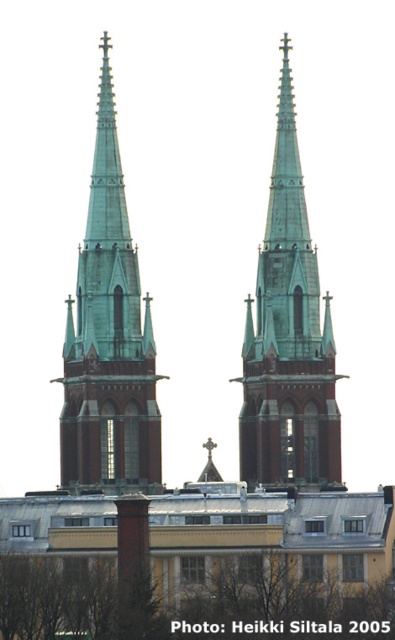
Question: Which point is closer to the camera taking this photo?

Choices:
 (A) (235, 616)
 (B) (257, 308)

Answer: (A)

Question: Is green copper spire at center bigger than green copper steeple at center?

Choices:
 (A) no
 (B) yes

Answer: (B)

Question: Which object is closer to the camera taking this photo?

Choices:
 (A) green copper spire at center
 (B) green copper steeple at center

Answer: (A)

Question: Is green copper steeple at center below brown leafy tree at lower center?

Choices:
 (A) no
 (B) yes

Answer: (A)

Question: Is green copper spire at center behind green copper steeple at center?

Choices:
 (A) yes
 (B) no

Answer: (B)

Question: Which of the following is the closest to the observer?

Choices:
 (A) green copper steeple at center
 (B) green copper spire at center

Answer: (B)